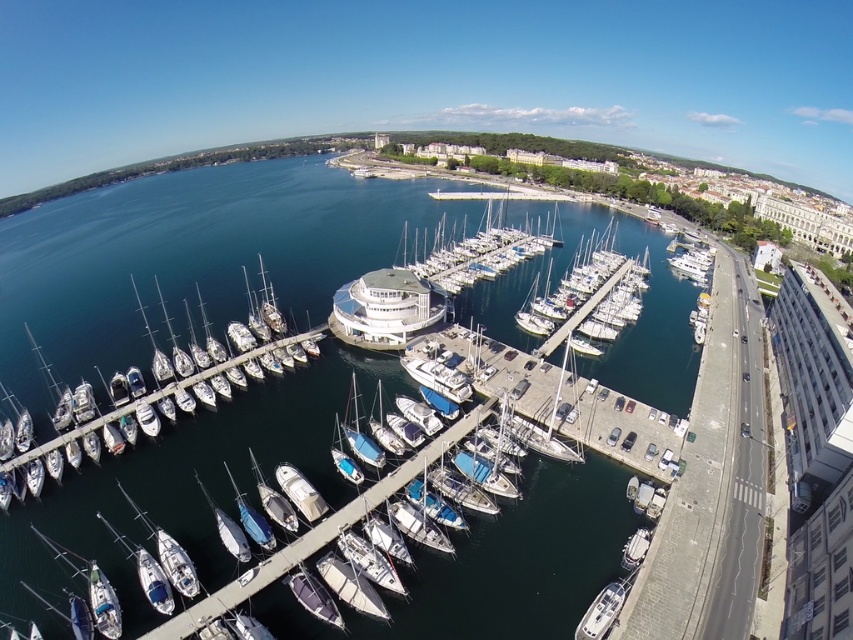
You are a boat owner who wants to moor your boat near the white glossy sailboat at lower center. Based on the scene, which direction should you head to reach the dark blue water at center?

The dark blue water at center is positioned on the right side of the white glossy sailboat at lower center, so you should head to the right to reach the dark blue water at center.

You are a drone operator trying to capture a photo of the marina from above. The drone must stay above the dark blue water at center to get the best shot. According to the coordinates provided, where should the drone be positioned?

The drone should be positioned at the coordinates point (190, 259) to capture the best shot above the dark blue water at center.